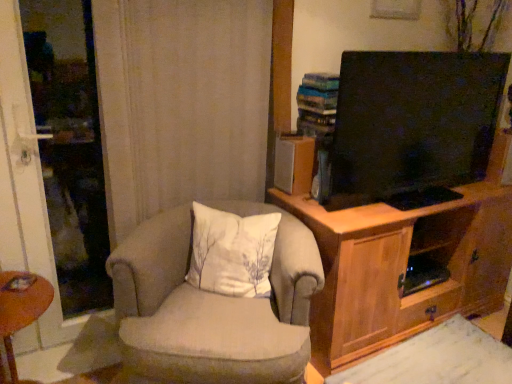
Question: Is wooden cabinet at right thinner than white fabric pillow at center?

Choices:
 (A) no
 (B) yes

Answer: (A)

Question: Considering the relative sizes of wooden cabinet at right and white fabric pillow at center in the image provided, is wooden cabinet at right taller than white fabric pillow at center?

Choices:
 (A) yes
 (B) no

Answer: (A)

Question: Is wooden cabinet at right in front of white fabric pillow at center?

Choices:
 (A) yes
 (B) no

Answer: (B)

Question: Can you confirm if wooden cabinet at right is positioned to the left of white fabric pillow at center?

Choices:
 (A) yes
 (B) no

Answer: (B)

Question: Considering the relative sizes of wooden cabinet at right and white fabric pillow at center in the image provided, is wooden cabinet at right shorter than white fabric pillow at center?

Choices:
 (A) yes
 (B) no

Answer: (B)

Question: Is wooden cabinet at right looking in the opposite direction of white fabric pillow at center?

Choices:
 (A) no
 (B) yes

Answer: (A)

Question: Can you confirm if wooden cabinet at right is taller than beige fabric chair at center?

Choices:
 (A) yes
 (B) no

Answer: (A)

Question: Can you confirm if wooden cabinet at right is wider than beige fabric chair at center?

Choices:
 (A) yes
 (B) no

Answer: (A)

Question: Does wooden cabinet at right turn towards beige fabric chair at center?

Choices:
 (A) no
 (B) yes

Answer: (B)

Question: Can you confirm if wooden cabinet at right is positioned to the left of beige fabric chair at center?

Choices:
 (A) yes
 (B) no

Answer: (B)

Question: Can beige fabric chair at center be found inside wooden cabinet at right?

Choices:
 (A) no
 (B) yes

Answer: (A)

Question: Is the surface of wooden cabinet at right in direct contact with beige fabric chair at center?

Choices:
 (A) yes
 (B) no

Answer: (B)

Question: Can you confirm if brown wooden desk at lower left is shorter than beige fabric chair at center?

Choices:
 (A) yes
 (B) no

Answer: (A)